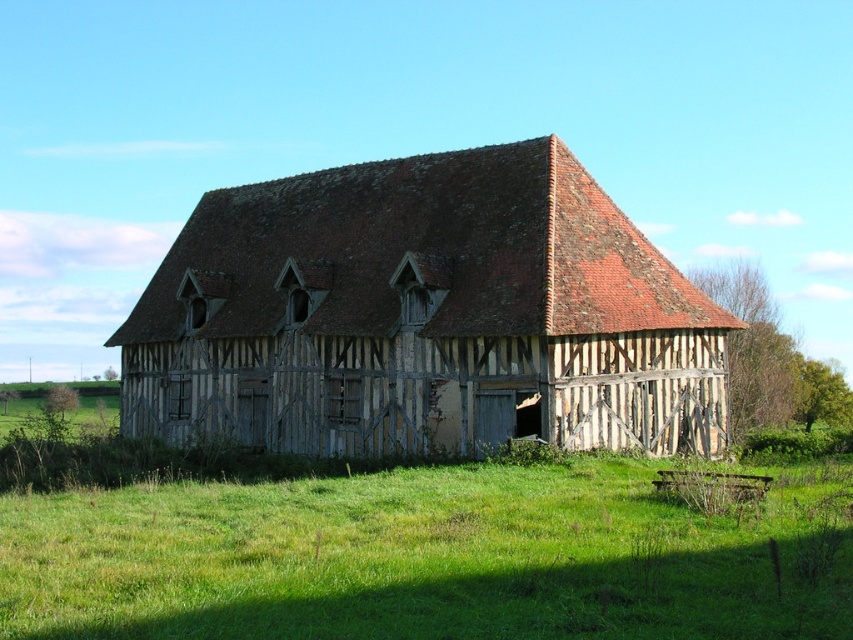
You are a farmer standing in the middle of a field. You see a weathered wood barn at center and green grass at center. Which object is larger in size?

The weathered wood barn at center is bigger than the green grass at center.

You are standing in a rural area and see the weathered wood barn at center and the green grass at center. Which object is closer to you?

The weathered wood barn at center is closer to you because the green grass at center is behind it.

You are standing in a rural area and see the weathered wood barn at center and the green grass at center. Which object is higher in elevation?

The weathered wood barn at center is above the green grass at center, so it is higher in elevation.